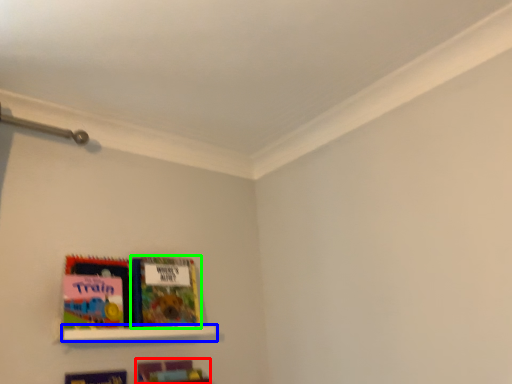
Question: Which object is the farthest from book (highlighted by a red box)? Choose among these: shelf (highlighted by a blue box) or book (highlighted by a green box).

Choices:
 (A) shelf
 (B) book

Answer: (B)